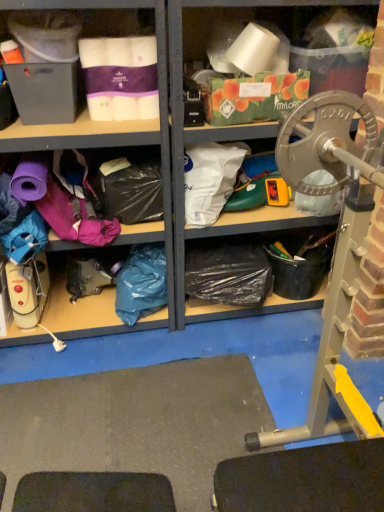
Question: From their relative heights in the image, would you say white plastic bag at center, the first clothing viewed from the top, is taller or shorter than blue plastic bag at lower left, placed as the 1th clothing when sorted from left to right?

Choices:
 (A) short
 (B) tall

Answer: (A)

Question: In terms of size, does white plastic bag at center, the first clothing viewed from the top, appear bigger or smaller than blue plastic bag at lower left, which appears as the second clothing when viewed from the top?

Choices:
 (A) big
 (B) small

Answer: (B)

Question: Choose the correct answer: Is white plastic bag at center, the first clothing viewed from the top, inside blue plastic bag at lower left, the 2th clothing viewed from the right, or outside it?

Choices:
 (A) outside
 (B) inside

Answer: (A)

Question: Is blue plastic bag at lower left, the 2th clothing viewed from the right, inside or outside of white plastic bag at center, the first clothing viewed from the top?

Choices:
 (A) outside
 (B) inside

Answer: (A)

Question: Looking at the image, does blue plastic bag at lower left, the 2th clothing viewed from the right, seem bigger or smaller compared to white plastic bag at center, which is the 2th clothing in bottom-to-top order?

Choices:
 (A) big
 (B) small

Answer: (A)

Question: From the image's perspective, is blue plastic bag at lower left, which appears as the second clothing when viewed from the top, positioned above or below white plastic bag at center, arranged as the 2th clothing when viewed from the left?

Choices:
 (A) above
 (B) below

Answer: (B)

Question: Is blue plastic bag at lower left, placed as the 1th clothing when sorted from left to right, taller or shorter than white plastic bag at center, the first clothing viewed from the top?

Choices:
 (A) short
 (B) tall

Answer: (B)